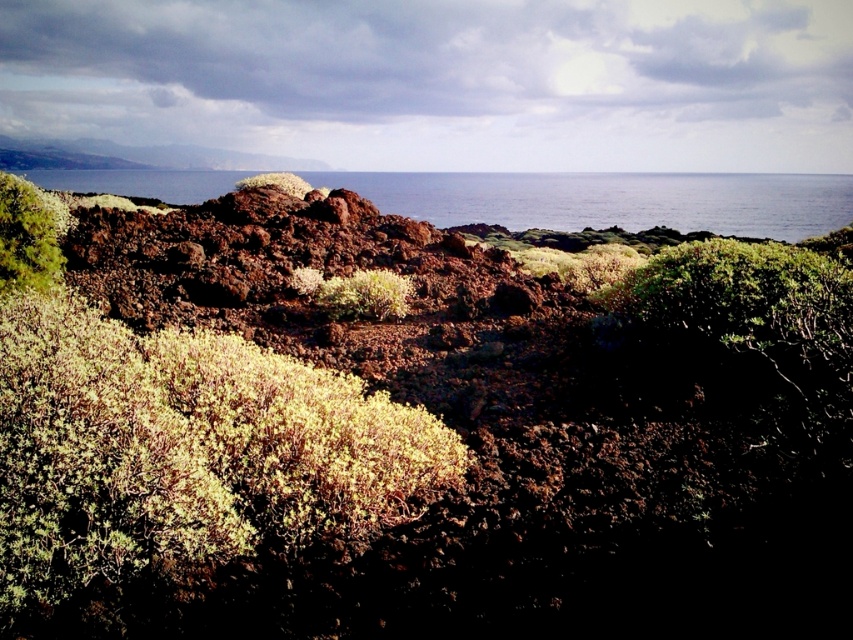
Question: Which of the following is the closest to the observer?

Choices:
 (A) green fuzzy bush at upper left
 (B) green fuzzy rock at center
 (C) green fuzzy bush at center
 (D) blue water at center

Answer: (A)

Question: Is green fuzzy bush at upper left thinner than green fuzzy bush at center?

Choices:
 (A) yes
 (B) no

Answer: (B)

Question: Does blue water at center appear under green fuzzy bush at center?

Choices:
 (A) yes
 (B) no

Answer: (B)

Question: Among these objects, which one is farthest from the camera?

Choices:
 (A) green fuzzy rock at center
 (B) blue water at center

Answer: (B)

Question: Which object appears farthest from the camera in this image?

Choices:
 (A) green fuzzy bush at upper left
 (B) green fuzzy bush at center

Answer: (B)

Question: Is green fuzzy bush at center wider than green fuzzy rock at center?

Choices:
 (A) yes
 (B) no

Answer: (B)